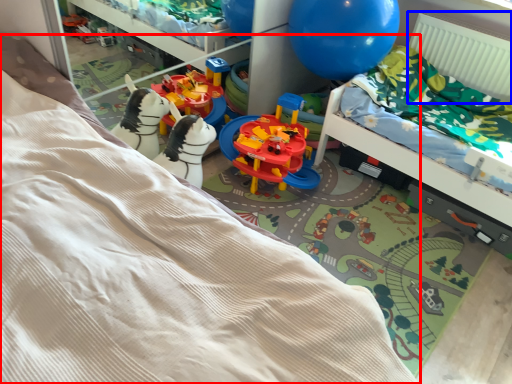
Question: Which object appears farthest to the camera in this image, bed (highlighted by a red box) or radiator (highlighted by a blue box)?

Choices:
 (A) bed
 (B) radiator

Answer: (B)